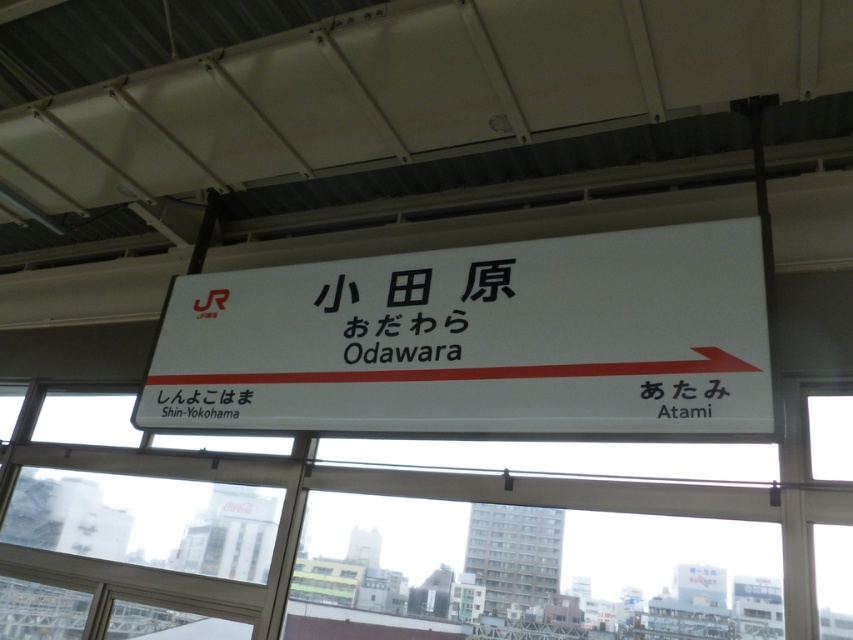
You are a traveler looking for the ticket counter at the station. You see a white plastic sign at center and a transparent glass window at center. Which one is positioned higher up?

→ The white plastic sign at center is located above the transparent glass window at center, so it is positioned higher up.

You are a traveler looking for the station name displayed on the white plastic sign at center and the transparent glass window at center. Which one do you think is bigger?

The white plastic sign at center is larger in size than the transparent glass window at center.